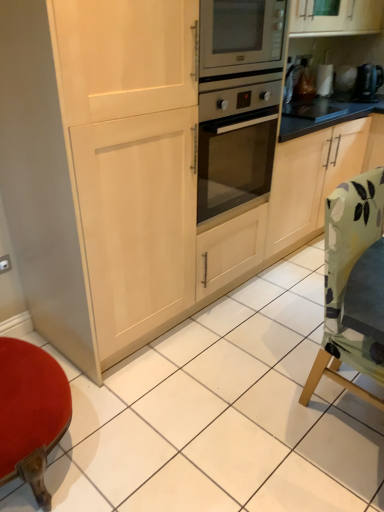
The width and height of the screenshot is (384, 512). Describe the element at coordinates (353, 285) in the screenshot. I see `green fabric chair at lower right` at that location.

What is the approximate height of green fabric chair at lower right?

It is 96.23 centimeters.

Where is `green fabric chair at lower right`? Image resolution: width=384 pixels, height=512 pixels. green fabric chair at lower right is located at coordinates (353, 285).

Describe the element at coordinates (368, 82) in the screenshot. The height and width of the screenshot is (512, 384). I see `metallic black kettle at upper right` at that location.

The height and width of the screenshot is (512, 384). Find the location of `metallic black kettle at upper right`. metallic black kettle at upper right is located at coordinates point(368,82).

Where is `green fabric chair at lower right`? This screenshot has width=384, height=512. green fabric chair at lower right is located at coordinates (353, 285).

Is metallic black kettle at upper right to the left or to the right of green fabric chair at lower right in the image?

Based on their positions, metallic black kettle at upper right is located to the right of green fabric chair at lower right.

In the image, is metallic black kettle at upper right positioned in front of or behind green fabric chair at lower right?

Clearly, metallic black kettle at upper right is behind green fabric chair at lower right.

Between point (373, 78) and point (359, 358), which one is positioned behind?

Positioned behind is point (373, 78).

From the image's perspective, is metallic black kettle at upper right over green fabric chair at lower right?

Yes, from the image's perspective, metallic black kettle at upper right is above green fabric chair at lower right.

From a real-world perspective, is metallic black kettle at upper right on top of green fabric chair at lower right?

Yes, from a real-world perspective, metallic black kettle at upper right is above green fabric chair at lower right.

Can you confirm if metallic black kettle at upper right is wider than green fabric chair at lower right?

No, metallic black kettle at upper right is not wider than green fabric chair at lower right.

Between metallic black kettle at upper right and green fabric chair at lower right, which one has more height?

With more height is green fabric chair at lower right.

Does metallic black kettle at upper right have a larger size compared to green fabric chair at lower right?

Incorrect, metallic black kettle at upper right is not larger than green fabric chair at lower right.

In the scene shown: Is metallic black kettle at upper right completely or partially outside of green fabric chair at lower right?

Yes.

Are metallic black kettle at upper right and green fabric chair at lower right far apart?

Yes.

Does metallic black kettle at upper right turn towards green fabric chair at lower right?

No, metallic black kettle at upper right is not oriented towards green fabric chair at lower right.

Find the location of `appliance on the right of green fabric chair at lower right`. appliance on the right of green fabric chair at lower right is located at coordinates (368, 82).

Considering the positions of objects green fabric chair at lower right and metallic black kettle at upper right in the image provided, who is more to the left, green fabric chair at lower right or metallic black kettle at upper right?

Positioned to the left is green fabric chair at lower right.

Based on the photo, does green fabric chair at lower right lie in front of metallic black kettle at upper right?

Yes, green fabric chair at lower right is closer to the viewer.

Between point (347, 228) and point (380, 73), which one is positioned in front?

Point (347, 228)

From the image's perspective, is green fabric chair at lower right beneath metallic black kettle at upper right?

Yes, from the image's perspective, green fabric chair at lower right is below metallic black kettle at upper right.

From a real-world perspective, is green fabric chair at lower right physically located above or below metallic black kettle at upper right?

green fabric chair at lower right is situated lower than metallic black kettle at upper right in the real world.

Considering the sizes of objects green fabric chair at lower right and metallic black kettle at upper right in the image provided, who is thinner, green fabric chair at lower right or metallic black kettle at upper right?

metallic black kettle at upper right is thinner.

Is green fabric chair at lower right taller than metallic black kettle at upper right?

Indeed, green fabric chair at lower right has a greater height compared to metallic black kettle at upper right.

Considering the relative sizes of green fabric chair at lower right and metallic black kettle at upper right in the image provided, is green fabric chair at lower right bigger than metallic black kettle at upper right?

Correct, green fabric chair at lower right is larger in size than metallic black kettle at upper right.

Is green fabric chair at lower right positioned beyond the bounds of metallic black kettle at upper right?

Indeed, green fabric chair at lower right is completely outside metallic black kettle at upper right.

Are green fabric chair at lower right and metallic black kettle at upper right far apart?

Indeed, green fabric chair at lower right is not near metallic black kettle at upper right.

In the scene shown: Is green fabric chair at lower right oriented towards metallic black kettle at upper right?

No, green fabric chair at lower right does not turn towards metallic black kettle at upper right.

How distant is green fabric chair at lower right from metallic black kettle at upper right?

green fabric chair at lower right and metallic black kettle at upper right are 2.08 meters apart.

Where is `appliance above the green fabric chair at lower right (from the image's perspective)`? appliance above the green fabric chair at lower right (from the image's perspective) is located at coordinates (368, 82).

This screenshot has height=512, width=384. Find the location of `appliance behind the green fabric chair at lower right`. appliance behind the green fabric chair at lower right is located at coordinates (368, 82).

Find the location of `appliance on the right side of green fabric chair at lower right`. appliance on the right side of green fabric chair at lower right is located at coordinates (368, 82).